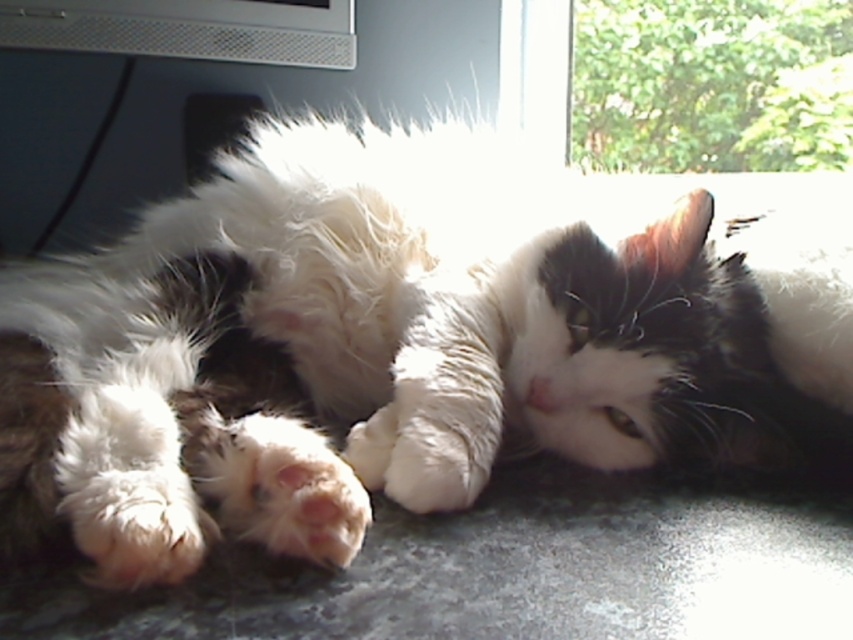
Can you confirm if green leafy foliage at upper right is taller than metallic silver computer monitor at upper center?

Yes.

Which is in front, point (688, 81) or point (39, 4)?

Point (39, 4)

Identify the location of green leafy foliage at upper right. Image resolution: width=853 pixels, height=640 pixels. coord(712,84).